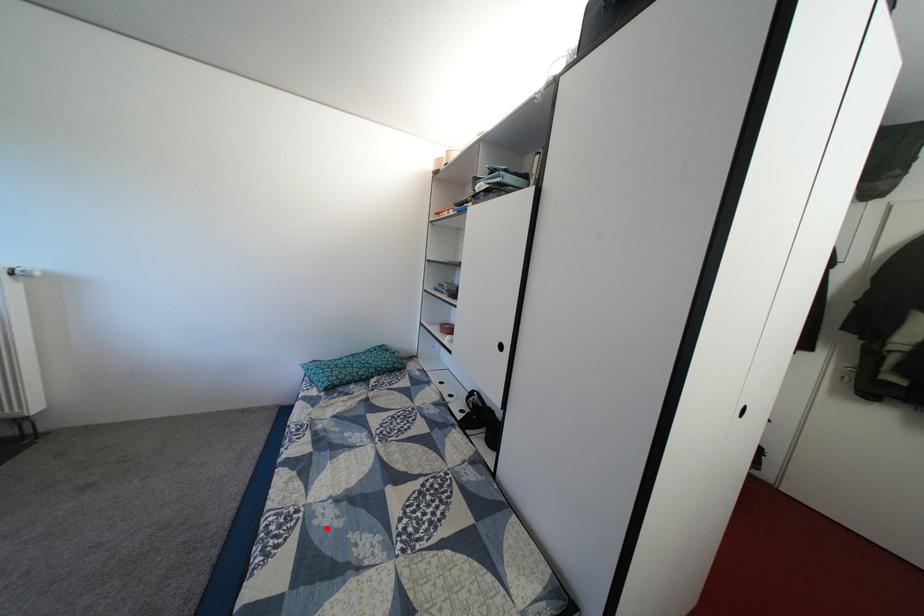
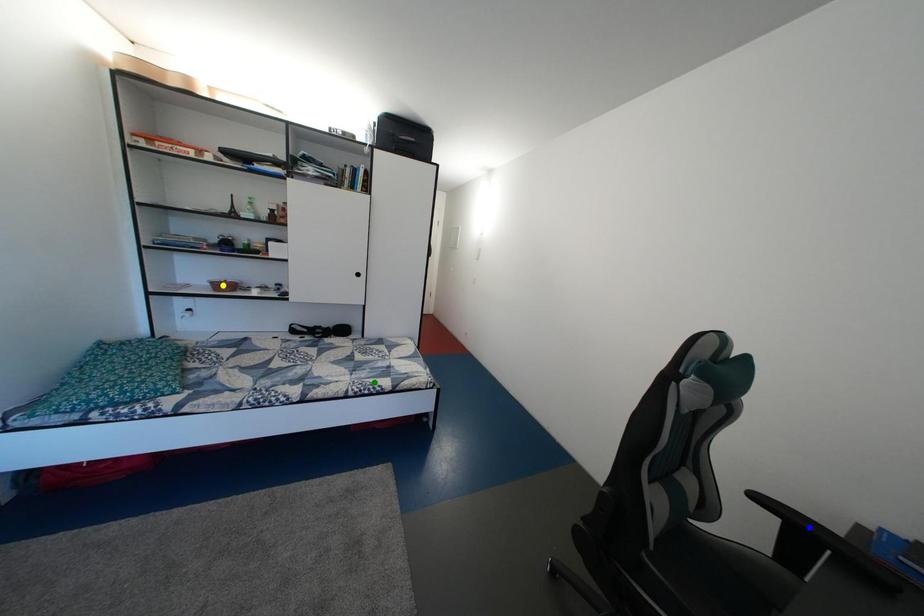
Question: I am providing you with two images of the same scene from different viewpoints. A red point is marked on the first image. You are given multiple points on the second image. Which mark in image 2 goes with the point in image 1?

Choices:
 (A) blue point
 (B) yellow point
 (C) green point

Answer: (C)